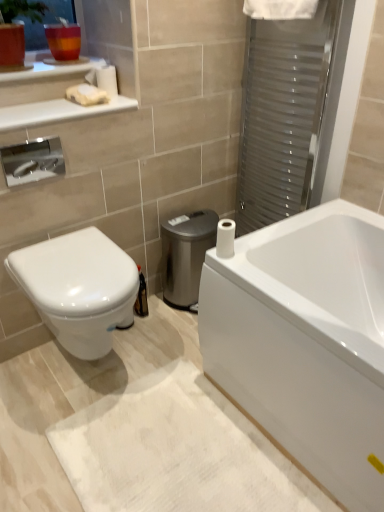
Question: Can you confirm if translucent glass cup at upper left is bigger than white matte toilet paper at upper left, the first toilet paper when ordered from back to front?

Choices:
 (A) no
 (B) yes

Answer: (B)

Question: From the image's perspective, would you say translucent glass cup at upper left is positioned over white matte toilet paper at upper left, the first toilet paper when ordered from back to front?

Choices:
 (A) yes
 (B) no

Answer: (A)

Question: Can you confirm if translucent glass cup at upper left is positioned to the right of white matte toilet paper at upper left, which is the 1th toilet paper in top-to-bottom order?

Choices:
 (A) yes
 (B) no

Answer: (B)

Question: From a real-world perspective, does translucent glass cup at upper left sit lower than white matte toilet paper at upper left, which is the 1th toilet paper from left to right?

Choices:
 (A) yes
 (B) no

Answer: (B)

Question: Is translucent glass cup at upper left taller than white matte toilet paper at upper left, which is the 1th toilet paper in top-to-bottom order?

Choices:
 (A) yes
 (B) no

Answer: (A)

Question: Is transparent plastic screen door at upper right bigger or smaller than translucent glass cup at upper left?

Choices:
 (A) small
 (B) big

Answer: (B)

Question: Would you say transparent plastic screen door at upper right is inside or outside translucent glass cup at upper left?

Choices:
 (A) outside
 (B) inside

Answer: (A)

Question: From their relative heights in the image, would you say transparent plastic screen door at upper right is taller or shorter than translucent glass cup at upper left?

Choices:
 (A) tall
 (B) short

Answer: (A)

Question: Is point (331, 15) positioned closer to the camera than point (29, 38)?

Choices:
 (A) farther
 (B) closer

Answer: (B)

Question: From the image's perspective, is transparent plastic screen door at upper right positioned above or below white glossy bathtub at lower right?

Choices:
 (A) above
 (B) below

Answer: (A)

Question: In the image, is transparent plastic screen door at upper right positioned in front of or behind white glossy bathtub at lower right?

Choices:
 (A) front
 (B) behind

Answer: (B)

Question: Considering the positions of transparent plastic screen door at upper right and white glossy bathtub at lower right in the image, is transparent plastic screen door at upper right taller or shorter than white glossy bathtub at lower right?

Choices:
 (A) tall
 (B) short

Answer: (A)

Question: In terms of width, does transparent plastic screen door at upper right look wider or thinner when compared to white glossy bathtub at lower right?

Choices:
 (A) wide
 (B) thin

Answer: (B)

Question: Is white glossy bathtub at lower right bigger or smaller than white matte soap at upper left?

Choices:
 (A) big
 (B) small

Answer: (A)

Question: Is white glossy bathtub at lower right wider or thinner than white matte soap at upper left?

Choices:
 (A) wide
 (B) thin

Answer: (A)